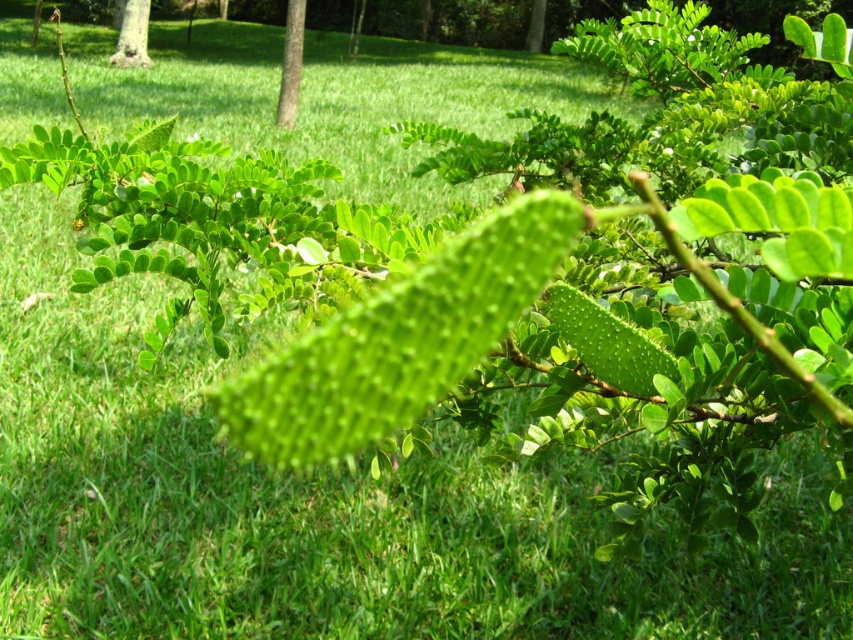
You are a landscape architect designing a garden layout. You have two trees to place in the garden plot. The green leafy tree at center and the green matte tree at upper left. Which tree should you choose if you want a taller tree in the garden?

The green leafy tree at center is taller than the green matte tree at upper left, so you should choose the green leafy tree at center for a taller tree in the garden.

You are standing in a park and see the green leafy tree at center and the green matte tree at upper left. Which tree is positioned higher in the image?

The green leafy tree at center is located above the green matte tree at upper left, so it is positioned higher in the image.

You are standing in a park and want to take a photo of the green leafy tree at center. If your camera has a maximum focus range of 10 meters, will it be able to capture the tree clearly?

The green leafy tree at center is 13.66 meters away from the camera, which exceeds the maximum focus range of 10 meters. Therefore, the camera will not be able to capture the tree clearly.